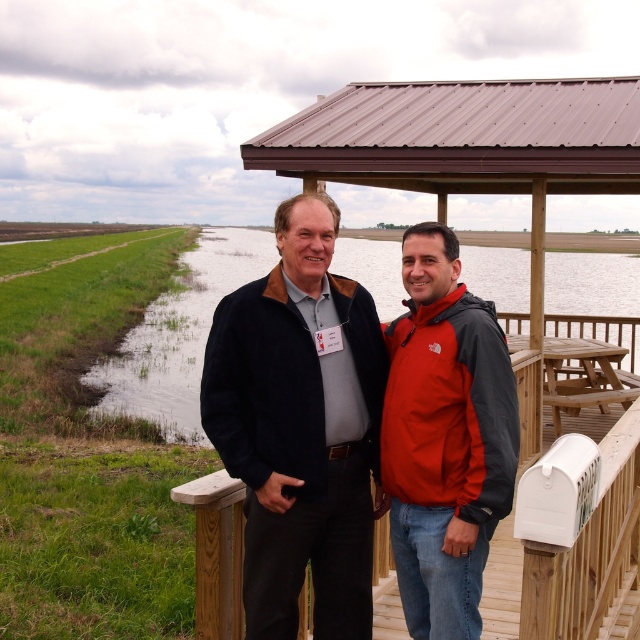
Is point (438, 426) positioned in front of point (545, 624)?

No.

Does matte red jacket at center have a greater width compared to wooden at center?

No, matte red jacket at center is not wider than wooden at center.

Which is behind, point (480, 384) or point (499, 628)?

Positioned behind is point (499, 628).

The width and height of the screenshot is (640, 640). In order to click on matte red jacket at center in this screenshot , I will do `click(444, 436)`.

Can you confirm if matte black jacket at center is shorter than wooden at center?

No, matte black jacket at center is not shorter than wooden at center.

Consider the image. Measure the distance between matte black jacket at center and wooden at center.

A distance of 3.91 feet exists between matte black jacket at center and wooden at center.

Between point (232, 440) and point (564, 563), which one is positioned behind?

Positioned behind is point (232, 440).

At what (x,y) coordinates should I click in order to perform the action: click on matte black jacket at center. Please return your answer as a coordinate pair (x, y). Looking at the image, I should click on (300, 428).

Which is behind, point (275, 321) or point (150, 365)?

The point (150, 365) is behind.

Who is shorter, matte black jacket at center or green grass at lower left?

With less height is matte black jacket at center.

Is point (305, 264) positioned after point (172, 298)?

That is False.

In order to click on matte black jacket at center in this screenshot , I will do `click(300, 428)`.